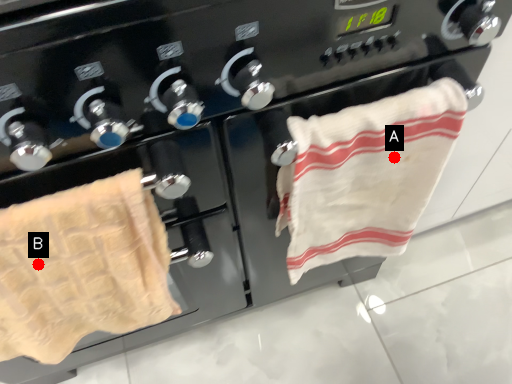
Question: Two points are circled on the image, labeled by A and B beside each circle. Which point is farther from the camera taking this photo?

Choices:
 (A) A is further
 (B) B is further

Answer: (A)